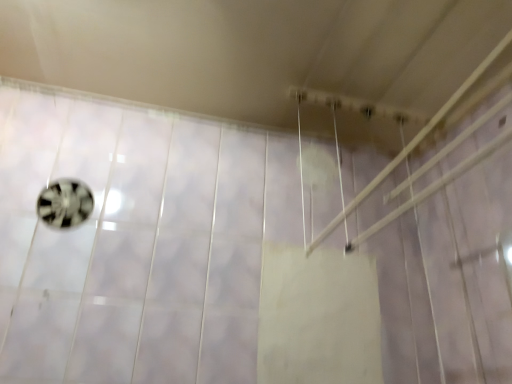
Question: From a real-world perspective, is white plastic shower at upper center located beneath metallic silver ball at left?

Choices:
 (A) no
 (B) yes

Answer: (A)

Question: Is metallic silver ball at left located within white plastic shower at upper center?

Choices:
 (A) yes
 (B) no

Answer: (B)

Question: Considering the relative sizes of white plastic shower at upper center and metallic silver ball at left in the image provided, is white plastic shower at upper center shorter than metallic silver ball at left?

Choices:
 (A) no
 (B) yes

Answer: (A)

Question: Is white plastic shower at upper center aimed at metallic silver ball at left?

Choices:
 (A) no
 (B) yes

Answer: (A)

Question: Does white plastic shower at upper center have a larger size compared to metallic silver ball at left?

Choices:
 (A) no
 (B) yes

Answer: (B)

Question: Can you confirm if white plastic shower at upper center is positioned to the left of metallic silver ball at left?

Choices:
 (A) yes
 (B) no

Answer: (B)

Question: Does metallic silver ball at left have a greater height compared to white plastic shower at upper center?

Choices:
 (A) yes
 (B) no

Answer: (B)

Question: Is metallic silver ball at left oriented away from white plastic shower at upper center?

Choices:
 (A) yes
 (B) no

Answer: (B)

Question: From the image's perspective, is metallic silver ball at left on top of white plastic shower at upper center?

Choices:
 (A) no
 (B) yes

Answer: (A)

Question: From a real-world perspective, is metallic silver ball at left on top of white plastic shower at upper center?

Choices:
 (A) yes
 (B) no

Answer: (B)

Question: Can you confirm if metallic silver ball at left is thinner than white plastic shower at upper center?

Choices:
 (A) no
 (B) yes

Answer: (B)

Question: Is metallic silver ball at left outside of white plastic shower at upper center?

Choices:
 (A) yes
 (B) no

Answer: (A)

Question: Looking at the image, does white plastic shower at upper center seem bigger or smaller compared to metallic silver ball at left?

Choices:
 (A) big
 (B) small

Answer: (A)